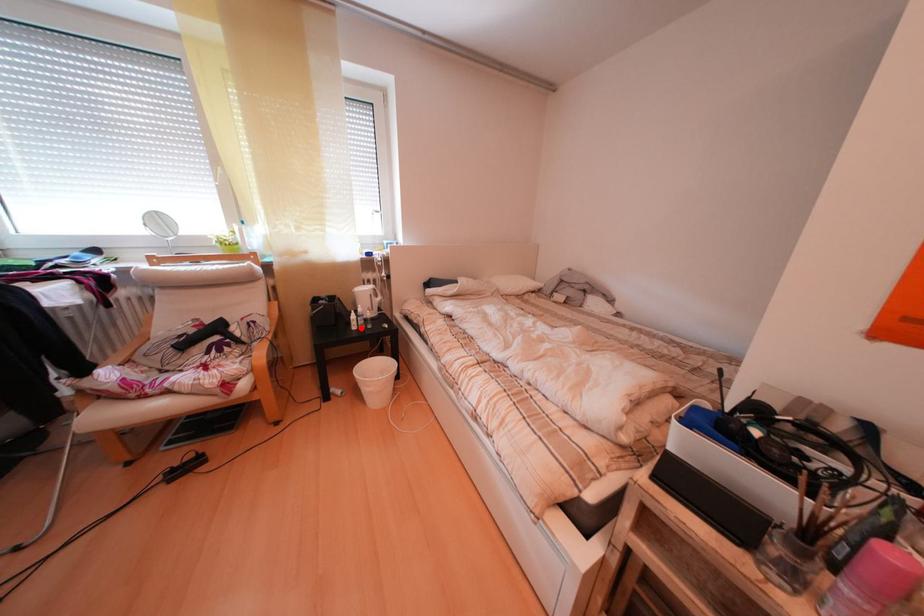
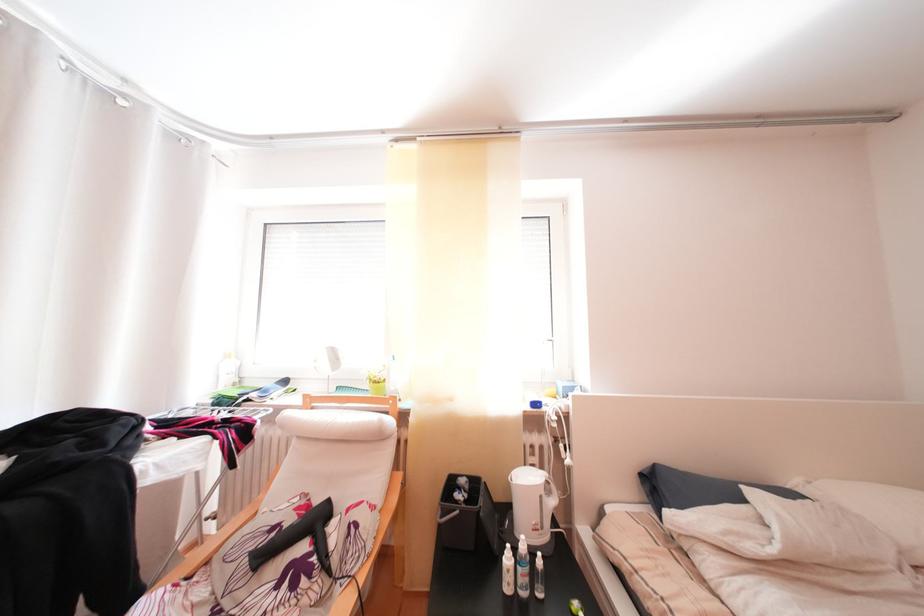
Question: I am providing you with two images of the same scene from different viewpoints. A red point is shown in image1. For the corresponding object point in image2, is it positioned nearer or farther from the camera?

Choices:
 (A) Nearer
 (B) Farther

Answer: (B)